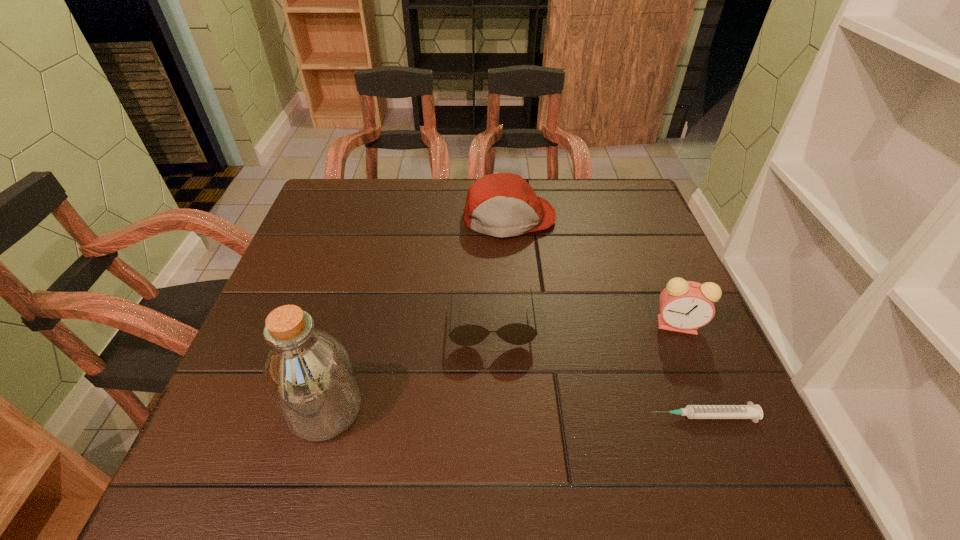
At what (x,y) coordinates should I click in order to perform the action: click on empty location between the alarm clock and the cap. Please return your answer as a coordinate pair (x, y). Looking at the image, I should click on (593, 272).

Locate an element on the screen. This screenshot has height=540, width=960. free space that is in between the alarm clock and the cap is located at coordinates (593, 272).

In order to click on object that stands as the third closest to the shortest object in this screenshot , I will do `click(501, 205)`.

This screenshot has height=540, width=960. In order to click on object identified as the closest to the bottle in this screenshot , I will do `click(518, 334)`.

At what (x,y) coordinates should I click in order to perform the action: click on free space that satisfies the following two spatial constraints: 1. on the front side of the syringe; 2. at the needle end of the fourth tallest object. Please return your answer as a coordinate pair (x, y). Looking at the image, I should click on (494, 416).

The height and width of the screenshot is (540, 960). I want to click on free space that satisfies the following two spatial constraints: 1. on the front side of the shortest object; 2. at the needle end of the cap, so pos(525,416).

Locate an element on the screen. free space that satisfies the following two spatial constraints: 1. on the front side of the shortest object; 2. at the needle end of the leftmost object is located at coordinates (324, 416).